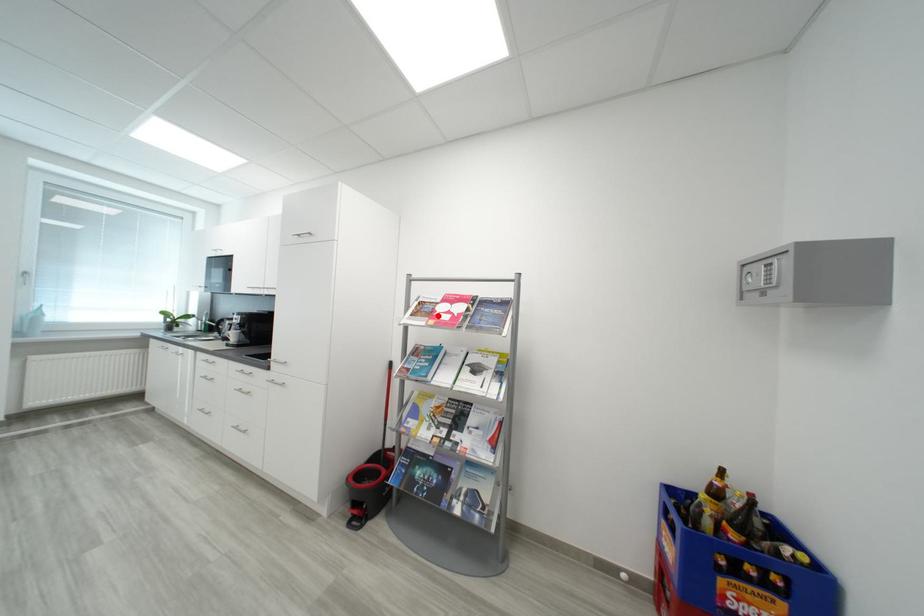
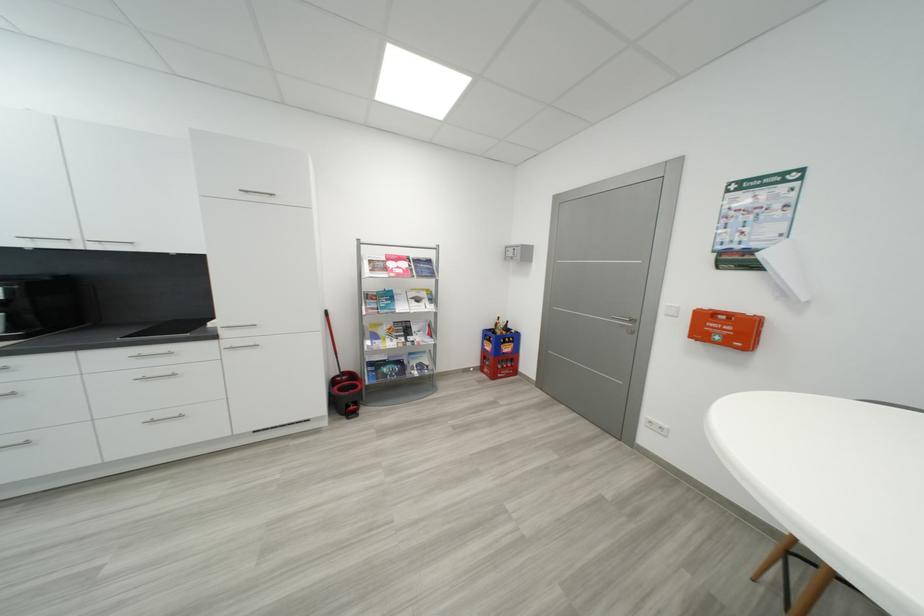
The point at the highlighted location is marked in the first image. Where is the corresponding point in the second image?

(393, 270)